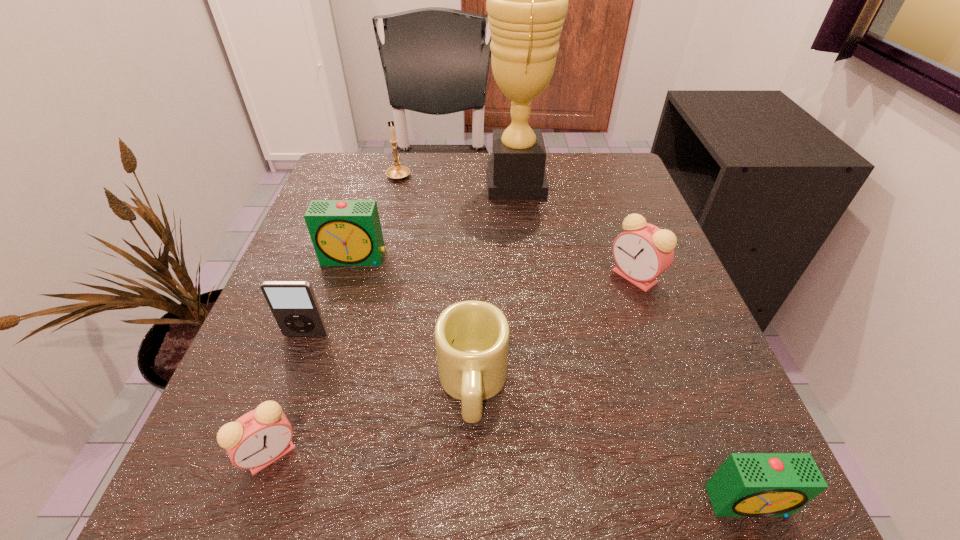
The image size is (960, 540). Identify the location of object that is at the near left corner. (258, 438).

Where is `object present at the near right corner`? object present at the near right corner is located at coordinates (747, 484).

In the image, there is a desktop. Identify the location of vacant space at the far edge. The image size is (960, 540). (491, 208).

Find the location of a particular element. blank area at the left edge is located at coordinates (260, 350).

In the image, there is a desktop. In order to click on vacant space at the right edge in this screenshot , I will do `click(616, 299)`.

I want to click on free point at the far right corner, so click(574, 193).

The width and height of the screenshot is (960, 540). What are the coordinates of `blank region between the iPod and the yellow trophy cup` in the screenshot? It's located at tap(411, 259).

What are the coordinates of `empty location between the right green alarm clock and the left pink alarm clock` in the screenshot? It's located at (510, 477).

At what (x,y) coordinates should I click in order to perform the action: click on free space between the nearest alarm clock and the beige mug. Please return your answer as a coordinate pair (x, y). The width and height of the screenshot is (960, 540). Looking at the image, I should click on (611, 443).

This screenshot has height=540, width=960. I want to click on free spot between the farther green alarm clock and the third farthest alarm clock, so click(313, 356).